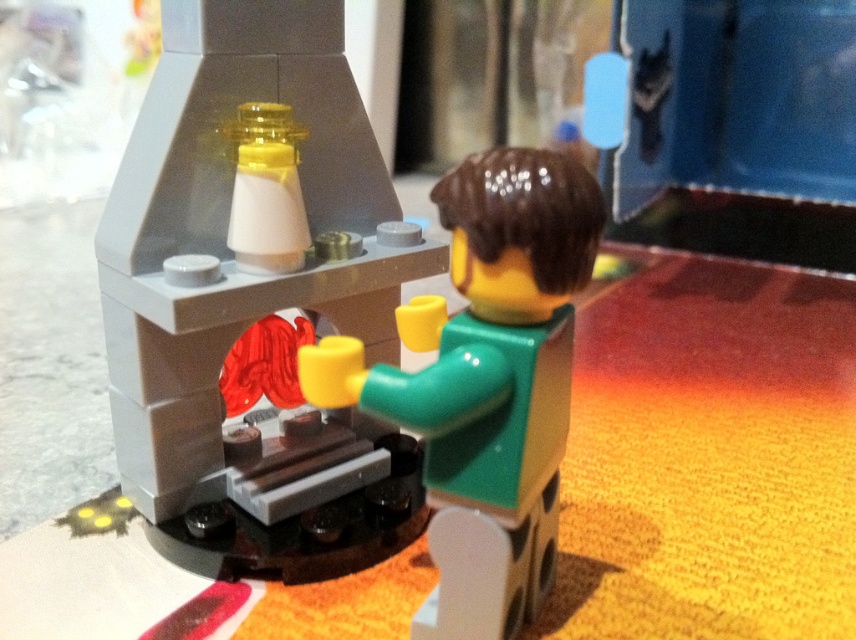
Question: Which point appears closest to the camera in this image?

Choices:
 (A) (275, 320)
 (B) (455, 528)

Answer: (B)

Question: Does smooth gray fireplace at center come behind green matte figure at center?

Choices:
 (A) yes
 (B) no

Answer: (A)

Question: Which point appears farthest from the camera in this image?

Choices:
 (A) (411, 627)
 (B) (313, 540)

Answer: (B)

Question: Which point is farther to the camera?

Choices:
 (A) [432, 198]
 (B) [289, 388]

Answer: (B)

Question: Is smooth gray fireplace at center thinner than green matte figure at center?

Choices:
 (A) no
 (B) yes

Answer: (A)

Question: Is smooth gray fireplace at center thinner than green matte figure at center?

Choices:
 (A) yes
 (B) no

Answer: (B)